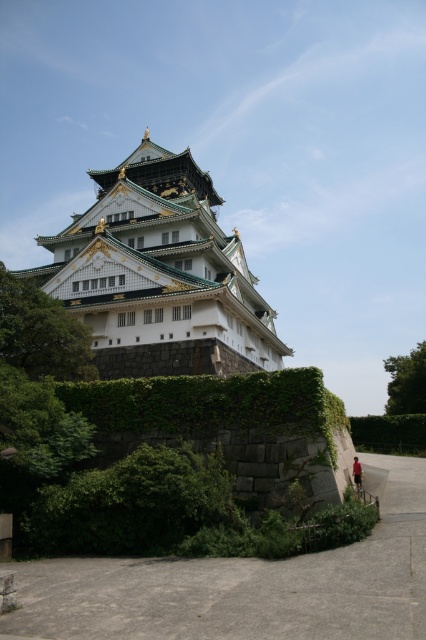
Between white stone palace at center and green leafy hedge at lower right, which one appears on the right side from the viewer's perspective?

Positioned to the right is green leafy hedge at lower right.

Does white stone palace at center have a smaller size compared to green leafy hedge at lower right?

No.

Is point (109, 192) farther from camera compared to point (370, 429)?

Yes.

Where is `white stone palace at center`? Image resolution: width=426 pixels, height=640 pixels. white stone palace at center is located at coordinates tap(158, 262).